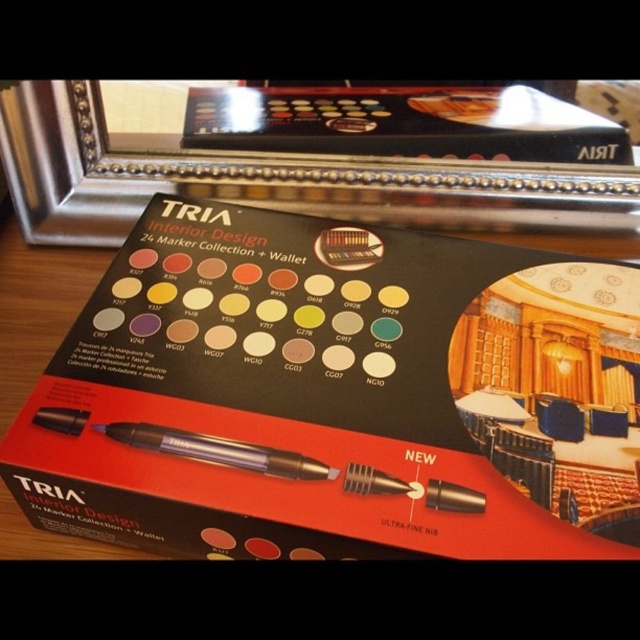
How much distance is there between black cardboard box at center and translucent plastic pen at center?

21.98 centimeters

Where is `black cardboard box at center`? The image size is (640, 640). black cardboard box at center is located at coordinates coord(337,396).